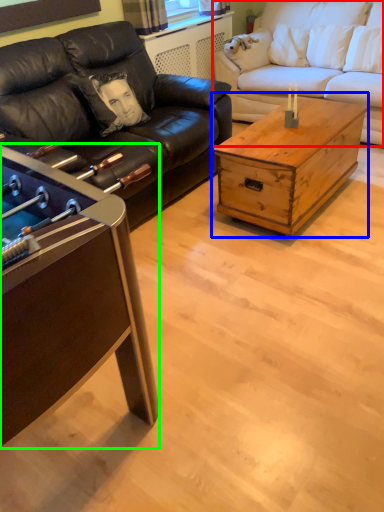
Question: Estimate the real-world distances between objects in this image. Which object is closer to studio couch (highlighted by a red box), coffee table (highlighted by a blue box) or coffee table (highlighted by a green box)?

Choices:
 (A) coffee table
 (B) coffee table

Answer: (A)